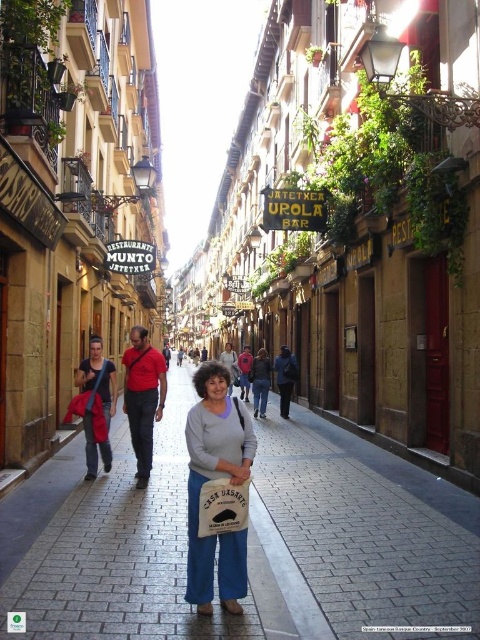
Can you confirm if brown brick pavement at center is positioned to the left of matte gray sweater at center?

Incorrect, brown brick pavement at center is not on the left side of matte gray sweater at center.

Between brown brick pavement at center and matte gray sweater at center, which one has less height?

Standing shorter between the two is brown brick pavement at center.

Identify the location of brown brick pavement at center. The height and width of the screenshot is (640, 480). (248, 541).